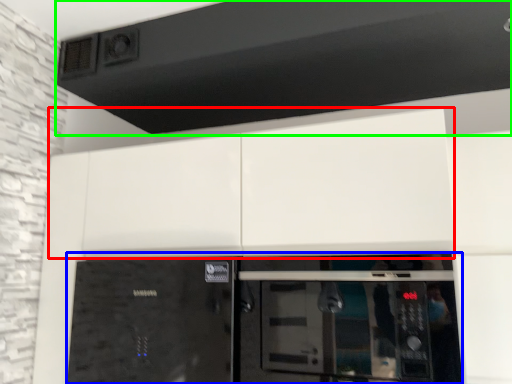
Question: Considering the real-world distances, which object is closest to cabinetry (highlighted by a red box)? home appliance (highlighted by a blue box) or exhaust hood (highlighted by a green box).

Choices:
 (A) home appliance
 (B) exhaust hood

Answer: (A)